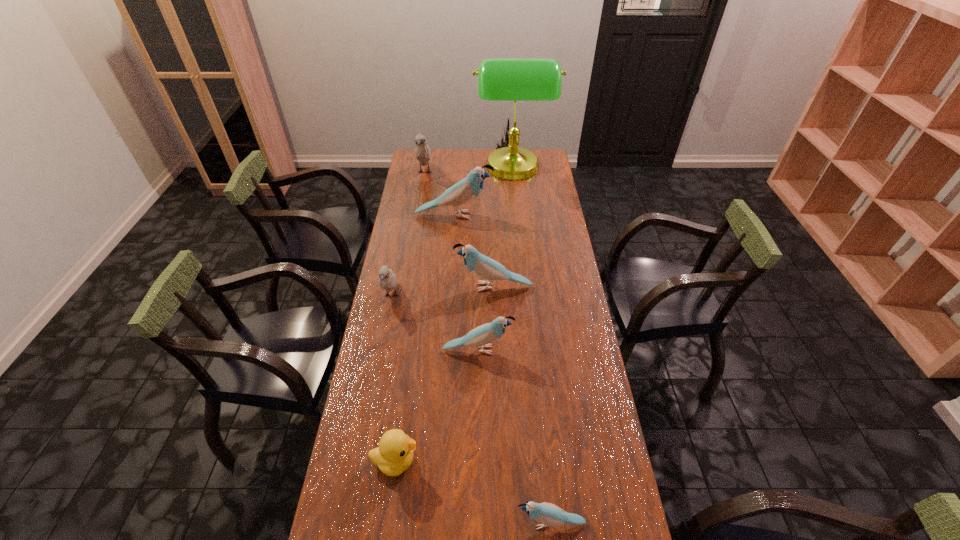
Image resolution: width=960 pixels, height=540 pixels. I want to click on unoccupied position between the tallest object and the farthest blue bird, so click(x=484, y=192).

Where is `free point between the nearer white bird and the second nearest bird`? The image size is (960, 540). free point between the nearer white bird and the second nearest bird is located at coordinates (435, 323).

At what (x,y) coordinates should I click in order to perform the action: click on vacant space that's between the fifth farthest bird and the farthest bird. Please return your answer as a coordinate pair (x, y). This screenshot has height=540, width=960. Looking at the image, I should click on (451, 261).

Find the location of a particular element. This screenshot has width=960, height=540. vacant point located between the farthest bird and the nearest bird is located at coordinates (488, 348).

At what (x,y) coordinates should I click in order to perform the action: click on blank region between the smaller white bird and the shortest bird. Please return your answer as a coordinate pair (x, y). The height and width of the screenshot is (540, 960). Looking at the image, I should click on (470, 409).

Locate an element on the screen. object that is the sixth closest to the shortest bird is located at coordinates (499, 79).

Identify which object is located as the second nearest to the nearer white bird. Please provide its 2D coordinates. Your answer should be formatted as a tuple, i.e. [(x, y)], where the tuple contains the x and y coordinates of a point satisfying the conditions above.

[(481, 336)]

Locate which bird ranks fourth in proximity to the farther white bird. Please provide its 2D coordinates. Your answer should be formatted as a tuple, i.e. [(x, y)], where the tuple contains the x and y coordinates of a point satisfying the conditions above.

[(481, 336)]

You are a GUI agent. You are given a task and a screenshot of the screen. Output one action in this format:
    pyautogui.click(x=<x>, y=<y>)
    Task: Click on the bird that is the closest one to the smallest blue bird
    The height and width of the screenshot is (540, 960).
    Given the screenshot: What is the action you would take?
    pyautogui.click(x=481, y=336)

Point out which blue bird is positioned as the nearest to the third smallest blue bird. Please provide its 2D coordinates. Your answer should be formatted as a tuple, i.e. [(x, y)], where the tuple contains the x and y coordinates of a point satisfying the conditions above.

[(481, 336)]